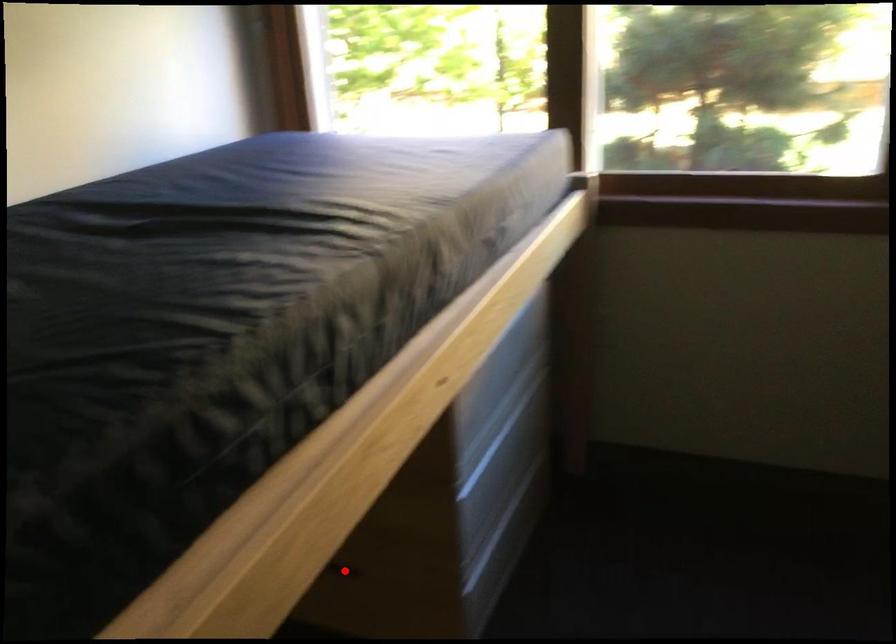
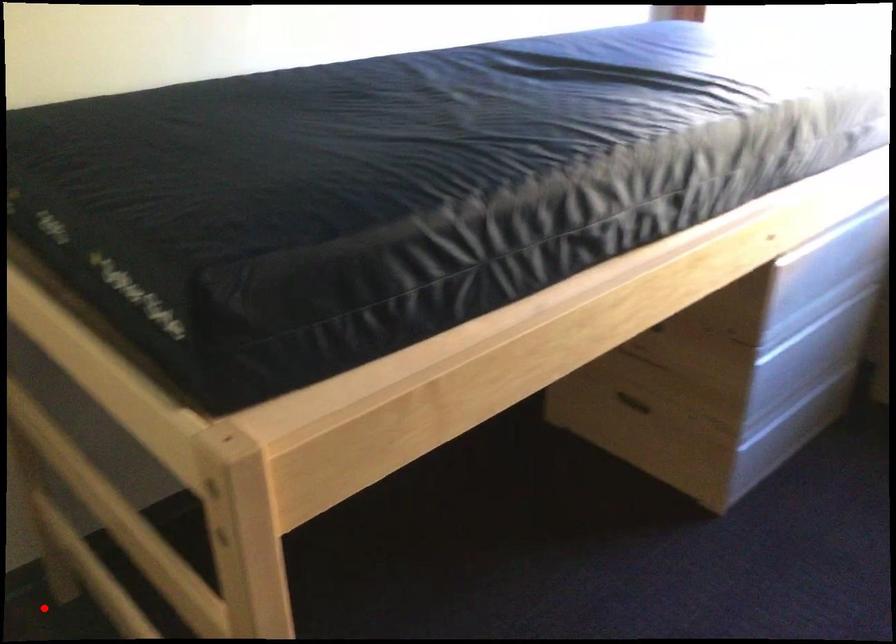
Looking at this image, I am providing you with two images of the same scene from different viewpoints. A red point is marked on the first image and another point is marked on the second image. Is the marked point in image1 the same physical position as the marked point in image2?

No